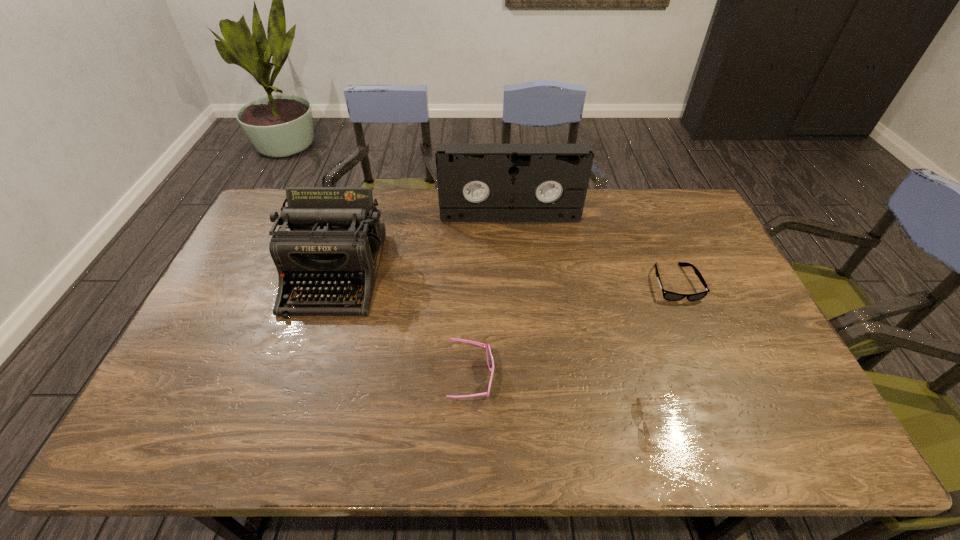
Where is `the farthest object`? The height and width of the screenshot is (540, 960). the farthest object is located at coordinates (476, 182).

At what (x,y) coordinates should I click in order to perform the action: click on the leftmost object. Please return your answer as a coordinate pair (x, y). The image size is (960, 540). Looking at the image, I should click on (336, 238).

In order to click on the second tallest object in this screenshot , I will do `click(336, 238)`.

In order to click on the third tallest object in this screenshot , I will do `click(490, 361)`.

This screenshot has width=960, height=540. What are the coordinates of `the leftmost sunglasses` in the screenshot? It's located at (490, 361).

Where is `the second tallest sunglasses`? Image resolution: width=960 pixels, height=540 pixels. the second tallest sunglasses is located at coordinates (667, 295).

The width and height of the screenshot is (960, 540). What are the coordinates of `the rightmost object` in the screenshot? It's located at (667, 295).

Locate an element on the screen. Image resolution: width=960 pixels, height=540 pixels. the shortest sunglasses is located at coordinates (639, 406).

Identify the location of the second sunglasses from left to right. The image size is (960, 540). click(x=639, y=406).

I want to click on free space located on the side of the videotape with visible spindles, so click(x=516, y=292).